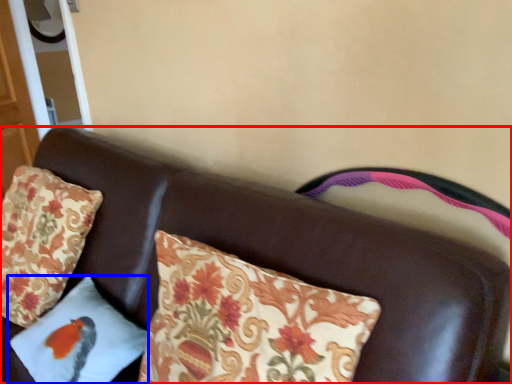
Question: Which point is further to the camera, furniture (highlighted by a red box) or pillow (highlighted by a blue box)?

Choices:
 (A) furniture
 (B) pillow

Answer: (B)